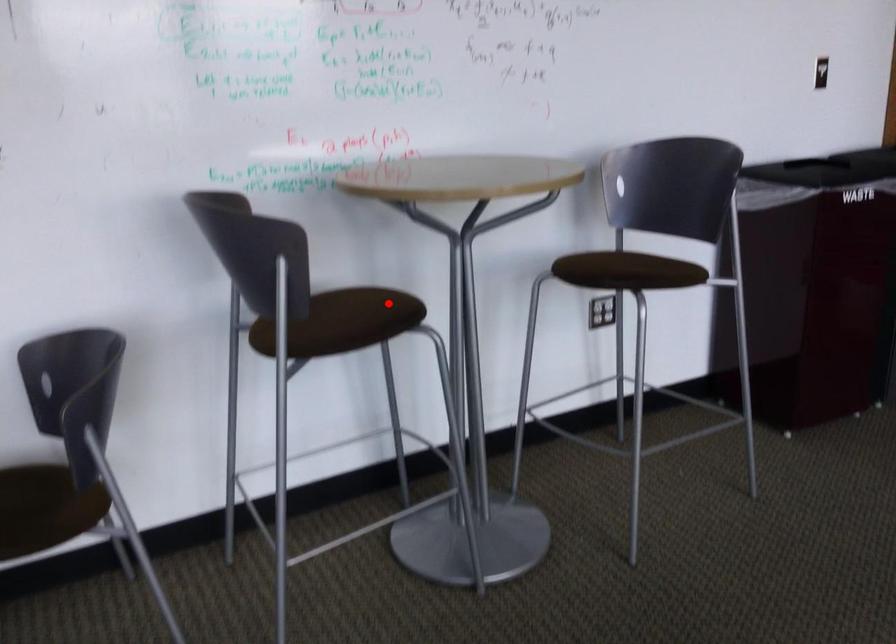
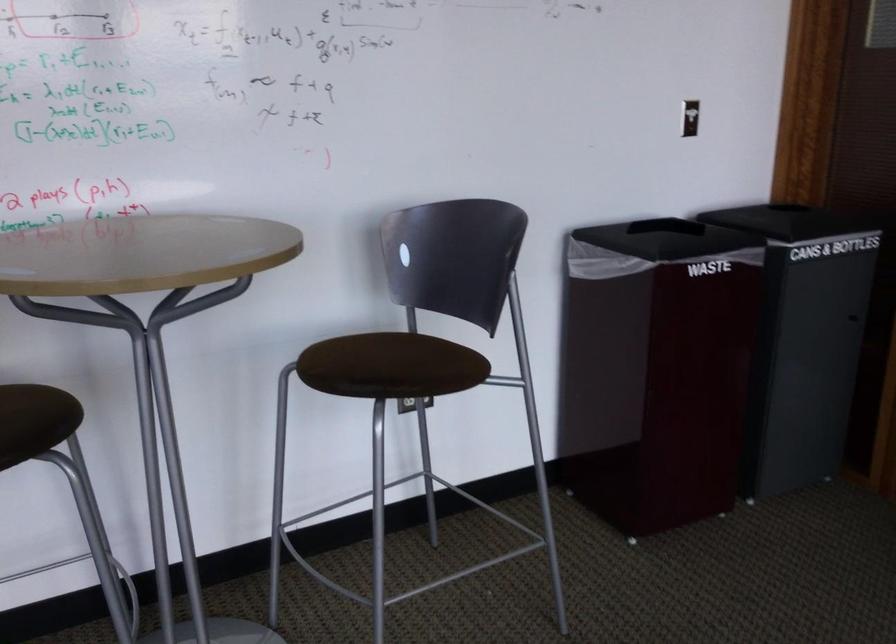
In the second image, find the point that corresponds to the highlighted location in the first image.

(36, 415)